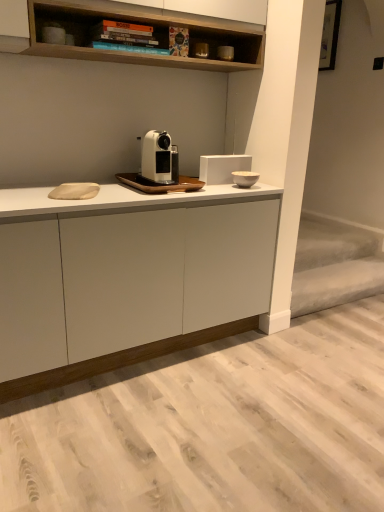
Question: From the image's perspective, is white ceramic bowl at upper right, which is counted as the second appliance, starting from the top, beneath matte black coffee machine at upper center, the first appliance viewed from the top?

Choices:
 (A) no
 (B) yes

Answer: (B)

Question: Is white ceramic bowl at upper right, placed as the 1th appliance when sorted from bottom to top, in front of matte black coffee machine at upper center, which is the second appliance from bottom to top?

Choices:
 (A) yes
 (B) no

Answer: (A)

Question: Is white ceramic bowl at upper right, placed as the 1th appliance when sorted from bottom to top, to the left of matte black coffee machine at upper center, which is the second appliance from bottom to top, from the viewer's perspective?

Choices:
 (A) yes
 (B) no

Answer: (B)

Question: Is white ceramic bowl at upper right, placed as the 1th appliance when sorted from bottom to top, further to the viewer compared to matte black coffee machine at upper center, which is the second appliance from bottom to top?

Choices:
 (A) yes
 (B) no

Answer: (B)

Question: Is matte black coffee machine at upper center, which is the second appliance from bottom to top, completely or partially inside white ceramic bowl at upper right, placed as the 1th appliance when sorted from bottom to top?

Choices:
 (A) yes
 (B) no

Answer: (B)

Question: Is point (162, 151) closer or farther from the camera than point (258, 192)?

Choices:
 (A) closer
 (B) farther

Answer: (A)

Question: In terms of size, does white matte coffee machine at center appear bigger or smaller than white matte cabinet at center?

Choices:
 (A) big
 (B) small

Answer: (B)

Question: From a real-world perspective, is white matte coffee machine at center above or below white matte cabinet at center?

Choices:
 (A) below
 (B) above

Answer: (B)

Question: From the image's perspective, is white matte coffee machine at center located above or below white matte cabinet at center?

Choices:
 (A) above
 (B) below

Answer: (A)

Question: Choose the correct answer: Is white matte cabinet at center inside white matte coffee machine at center or outside it?

Choices:
 (A) inside
 (B) outside

Answer: (B)

Question: Is white matte cabinet at center to the left or to the right of white matte coffee machine at center in the image?

Choices:
 (A) right
 (B) left

Answer: (B)

Question: Does point (147, 256) appear closer or farther from the camera than point (167, 155)?

Choices:
 (A) closer
 (B) farther

Answer: (A)

Question: Is white matte cabinet at center in front of or behind white matte coffee machine at center in the image?

Choices:
 (A) front
 (B) behind

Answer: (A)

Question: Is white ceramic bowl at upper right, placed as the 1th appliance when sorted from bottom to top, wider or thinner than white matte coffee machine at center?

Choices:
 (A) thin
 (B) wide

Answer: (A)

Question: Considering their positions, is white ceramic bowl at upper right, placed as the 1th appliance when sorted from bottom to top, located in front of or behind white matte coffee machine at center?

Choices:
 (A) behind
 (B) front

Answer: (A)